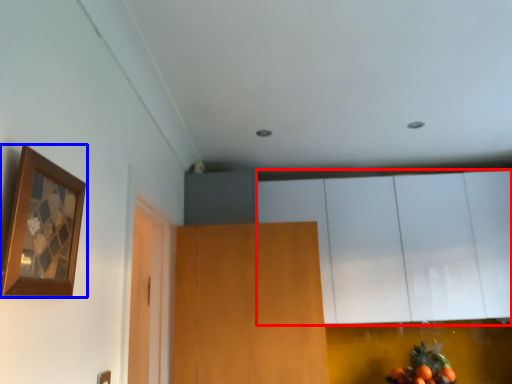
Question: Which point is further to the camera, cabinetry (highlighted by a red box) or picture frame (highlighted by a blue box)?

Choices:
 (A) cabinetry
 (B) picture frame

Answer: (A)